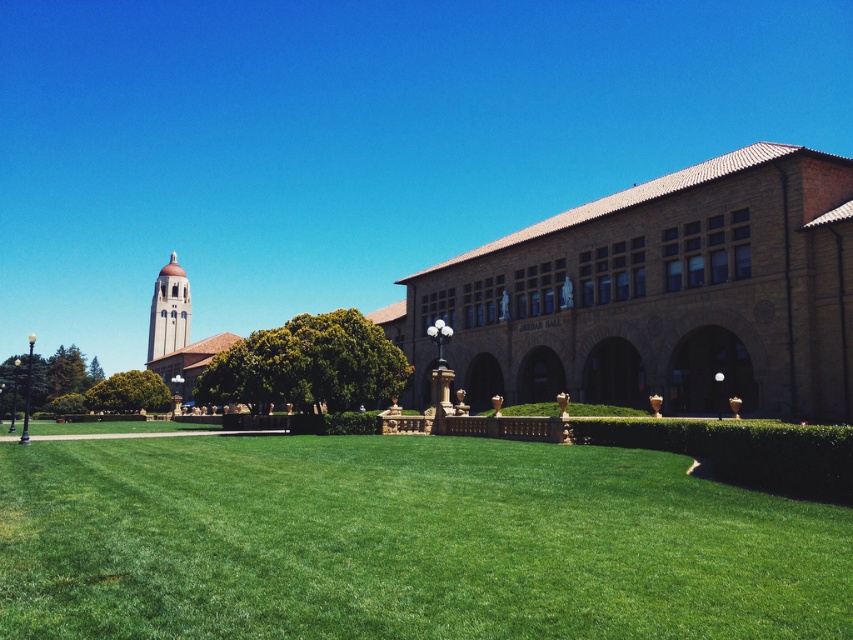
Does matte brick tower at center-left appear over green leafy hedge at lower left?

Yes, matte brick tower at center-left is above green leafy hedge at lower left.

Locate an element on the screen. matte brick tower at center-left is located at coordinates (169, 310).

At what (x,y) coordinates should I click in order to perform the action: click on matte brick tower at center-left. Please return your answer as a coordinate pair (x, y). Looking at the image, I should click on (169, 310).

Consider the image. Is green grass at center to the right of green leafy hedge at lower left from the viewer's perspective?

Correct, you'll find green grass at center to the right of green leafy hedge at lower left.

Describe the element at coordinates (404, 541) in the screenshot. I see `green grass at center` at that location.

The width and height of the screenshot is (853, 640). I want to click on green grass at center, so click(x=404, y=541).

Which is below, green leafy hedge at center or green leafy hedge at lower left?

green leafy hedge at lower left is lower down.

Is green leafy hedge at center further to camera compared to green leafy hedge at lower left?

No, green leafy hedge at center is closer to the viewer.

Between point (213, 376) and point (126, 397), which one is positioned in front?

Positioned in front is point (213, 376).

Where is `green leafy hedge at center`? This screenshot has width=853, height=640. green leafy hedge at center is located at coordinates (306, 364).